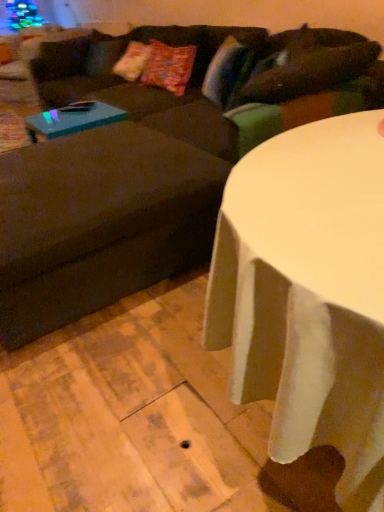
Question: Is white glossy table at center completely or partially outside of brown fabric swivel chair at left?

Choices:
 (A) yes
 (B) no

Answer: (A)

Question: Considering the relative sizes of white glossy table at center and brown fabric swivel chair at left in the image provided, is white glossy table at center shorter than brown fabric swivel chair at left?

Choices:
 (A) no
 (B) yes

Answer: (A)

Question: From the image's perspective, is white glossy table at center on top of brown fabric swivel chair at left?

Choices:
 (A) yes
 (B) no

Answer: (B)

Question: Is white glossy table at center bigger than brown fabric swivel chair at left?

Choices:
 (A) yes
 (B) no

Answer: (A)

Question: Does white glossy table at center have a greater height compared to brown fabric swivel chair at left?

Choices:
 (A) no
 (B) yes

Answer: (B)

Question: Considering the relative sizes of white glossy table at center and brown fabric swivel chair at left in the image provided, is white glossy table at center wider than brown fabric swivel chair at left?

Choices:
 (A) no
 (B) yes

Answer: (A)

Question: Is brown fabric swivel chair at left in front of white glossy table at center?

Choices:
 (A) no
 (B) yes

Answer: (A)

Question: Is brown fabric swivel chair at left touching white glossy table at center?

Choices:
 (A) no
 (B) yes

Answer: (A)

Question: Can you confirm if brown fabric swivel chair at left is positioned to the right of white glossy table at center?

Choices:
 (A) yes
 (B) no

Answer: (B)

Question: Is brown fabric swivel chair at left outside of white glossy table at center?

Choices:
 (A) yes
 (B) no

Answer: (A)

Question: From the image's perspective, is brown fabric swivel chair at left over white glossy table at center?

Choices:
 (A) yes
 (B) no

Answer: (A)

Question: Is brown fabric swivel chair at left facing away from white glossy table at center?

Choices:
 (A) yes
 (B) no

Answer: (B)

Question: Is teal glossy coffee table at left oriented away from white glossy table at center?

Choices:
 (A) no
 (B) yes

Answer: (A)